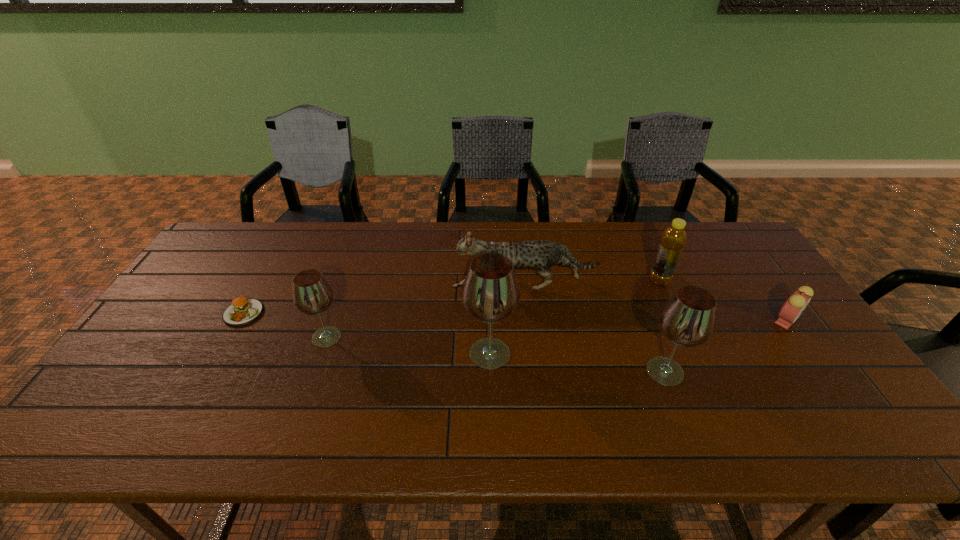
I want to click on vacant position located on the back of the shortest wineglass, so coord(346,284).

This screenshot has height=540, width=960. I want to click on vacant space situated 0.240m on the back of the second wineglass from right to left, so click(x=488, y=276).

Locate an element on the screen. The width and height of the screenshot is (960, 540). free space located on the left of the second tallest wineglass is located at coordinates (518, 372).

Where is `vacant space situated 0.280m on the right of the bottle`? The image size is (960, 540). vacant space situated 0.280m on the right of the bottle is located at coordinates (760, 280).

Where is `free point located 0.120m on the face of the cat`? Image resolution: width=960 pixels, height=540 pixels. free point located 0.120m on the face of the cat is located at coordinates (413, 286).

Identify the location of free space located on the face of the cat. (403, 286).

I want to click on free space located on the face of the cat, so click(x=391, y=286).

Identify the location of free space located 0.090m on the right of the patty. (294, 313).

What are the coordinates of `vacant space situated on the face of the sixth tallest object` in the screenshot? It's located at (833, 387).

Where is `object at the near edge`? The image size is (960, 540). object at the near edge is located at coordinates (x=688, y=318).